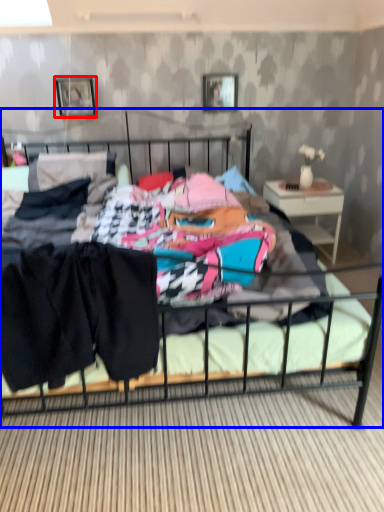
Question: Which point is closer to the camera, picture frame (highlighted by a red box) or bed (highlighted by a blue box)?

Choices:
 (A) picture frame
 (B) bed

Answer: (B)